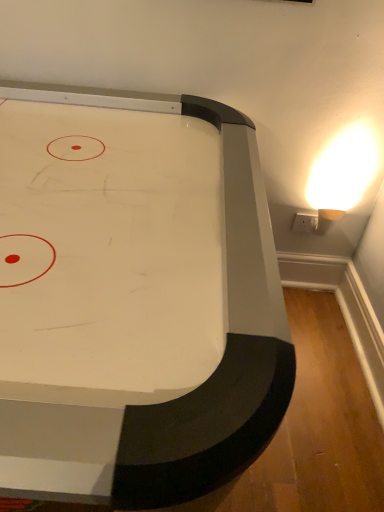
The height and width of the screenshot is (512, 384). Describe the element at coordinates (227, 334) in the screenshot. I see `white glossy air hockey table at upper left` at that location.

Find the location of a particular element. This screenshot has height=512, width=384. white glossy air hockey table at upper left is located at coordinates (227, 334).

Measure the distance between white glossy air hockey table at upper left and camera.

The depth of white glossy air hockey table at upper left is 17.88 inches.

At what (x,y) coordinates should I click in order to perform the action: click on white glossy air hockey table at upper left. Please return your answer as a coordinate pair (x, y). This screenshot has height=512, width=384. Looking at the image, I should click on (227, 334).